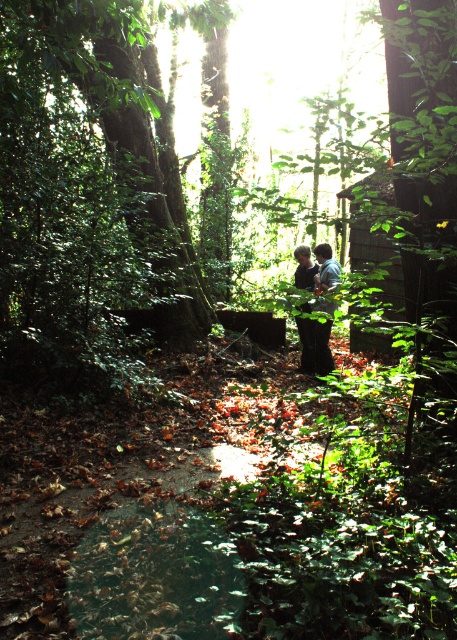
Does green leafy tree at center have a greater width compared to dark blue jeans at center?

Yes.

Is green leafy tree at center to the left of dark blue jeans at center from the viewer's perspective?

Correct, you'll find green leafy tree at center to the left of dark blue jeans at center.

Where is `green leafy tree at center`? This screenshot has width=457, height=640. green leafy tree at center is located at coordinates (90, 170).

Can you confirm if green leafy tree at center is thinner than black matte dress at center?

Incorrect, green leafy tree at center's width is not less than black matte dress at center's.

Can you confirm if green leafy tree at center is taller than black matte dress at center?

Yes, green leafy tree at center is taller than black matte dress at center.

Between point (76, 193) and point (307, 368), which one is positioned in front?

Point (76, 193) is more forward.

Where is `green leafy tree at center`? The image size is (457, 640). green leafy tree at center is located at coordinates (90, 170).

The height and width of the screenshot is (640, 457). I want to click on black matte dress at center, so click(x=315, y=268).

Does black matte dress at center come behind dark blue jeans at center?

Yes, it is.

Locate an element on the screen. black matte dress at center is located at coordinates (315, 268).